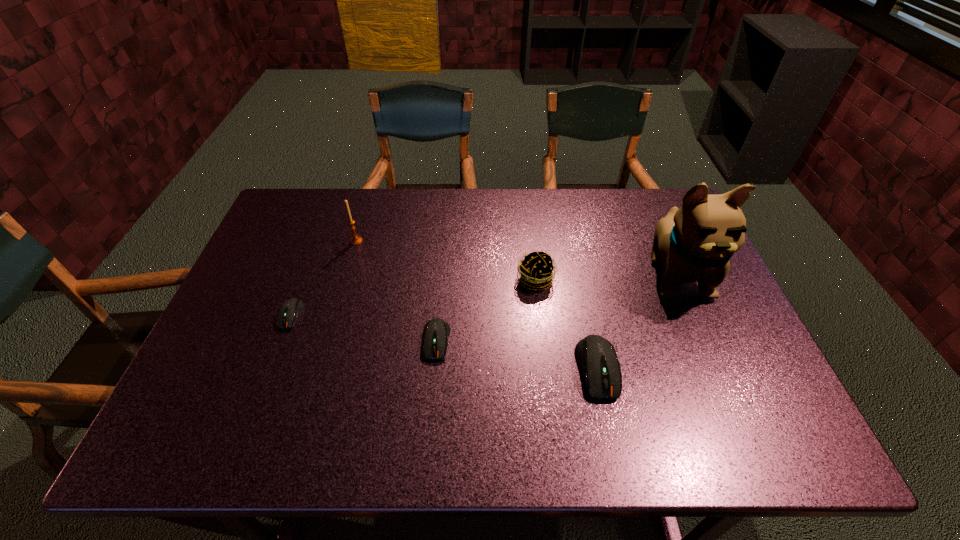
Identify the location of free space at the far edge. (526, 200).

The width and height of the screenshot is (960, 540). I want to click on free space at the near edge of the desktop, so click(485, 386).

Locate an element on the screen. The height and width of the screenshot is (540, 960). blank space at the left edge is located at coordinates (268, 258).

Find the location of a particular element. The image size is (960, 540). vacant space at the far left corner of the desktop is located at coordinates (296, 225).

Image resolution: width=960 pixels, height=540 pixels. Find the location of `free space between the tallest object and the shortest computer equipment`. free space between the tallest object and the shortest computer equipment is located at coordinates (484, 294).

The height and width of the screenshot is (540, 960). What are the coordinates of `vacant area that lies between the fifth object from left to right and the second object from left to right` in the screenshot? It's located at (477, 305).

The image size is (960, 540). I want to click on free space between the second shortest object and the tallest computer equipment, so click(516, 355).

At what (x,y) coordinates should I click in order to perform the action: click on free spot between the tallest object and the fifth object from right to left. Please return your answer as a coordinate pair (x, y). The width and height of the screenshot is (960, 540). Looking at the image, I should click on (516, 257).

Find the location of `vacant space in between the fifth object from left to right and the candle_holder`. vacant space in between the fifth object from left to right and the candle_holder is located at coordinates tap(477, 305).

Locate an element on the screen. This screenshot has height=540, width=960. empty space that is in between the tallest object and the shortest object is located at coordinates (484, 294).